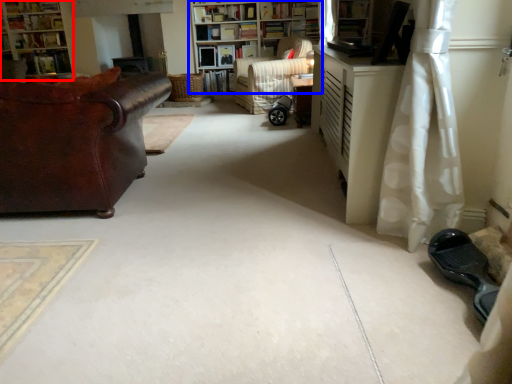
Question: Which object is further to the camera taking this photo, bookcase (highlighted by a red box) or bookcase (highlighted by a blue box)?

Choices:
 (A) bookcase
 (B) bookcase

Answer: (A)